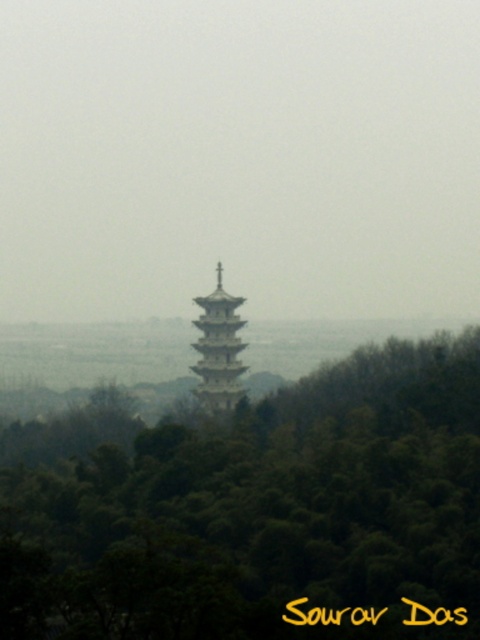
Is point (423, 488) closer to camera compared to point (211, 342)?

No.

Between point (324, 564) and point (222, 381), which one is positioned behind?

The point (324, 564) is more distant.

Between point (160, 528) and point (240, 348), which one is positioned behind?

Positioned behind is point (160, 528).

At what (x,y) coordinates should I click in order to perform the action: click on green matte tree at center. Please return your answer as a coordinate pair (x, y). The height and width of the screenshot is (640, 480). Looking at the image, I should click on (252, 506).